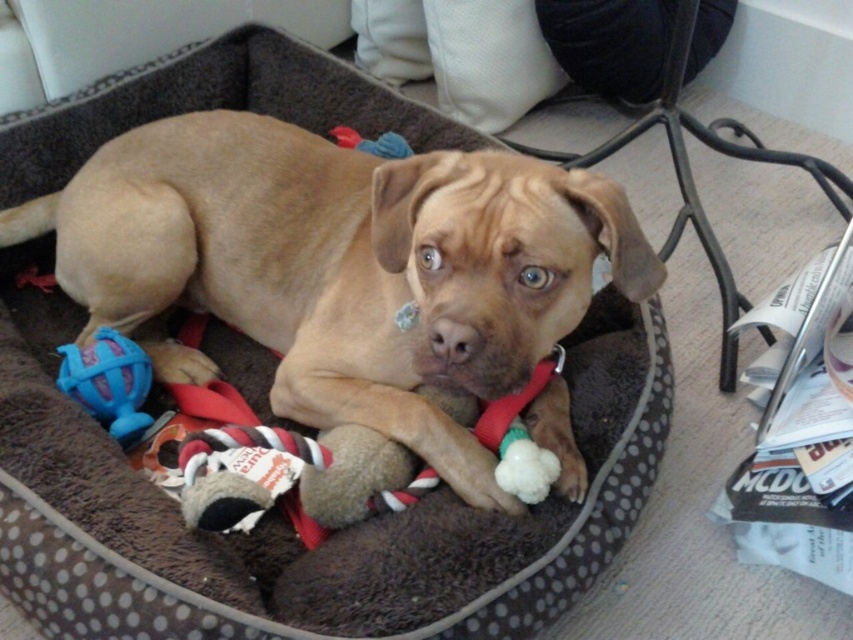
Question: Which object is farther from the camera taking this photo?

Choices:
 (A) blue rubber ball at lower left
 (B) brown fur dog at center

Answer: (A)

Question: Does brown fur dog at center have a lesser width compared to blue rubber ball at lower left?

Choices:
 (A) no
 (B) yes

Answer: (A)

Question: Can you confirm if brown fur dog at center is positioned above blue rubber ball at lower left?

Choices:
 (A) yes
 (B) no

Answer: (A)

Question: Which point is closer to the camera?

Choices:
 (A) brown fur dog at center
 (B) blue rubber ball at lower left

Answer: (A)

Question: Can you confirm if brown fur dog at center is positioned to the right of blue rubber ball at lower left?

Choices:
 (A) yes
 (B) no

Answer: (A)